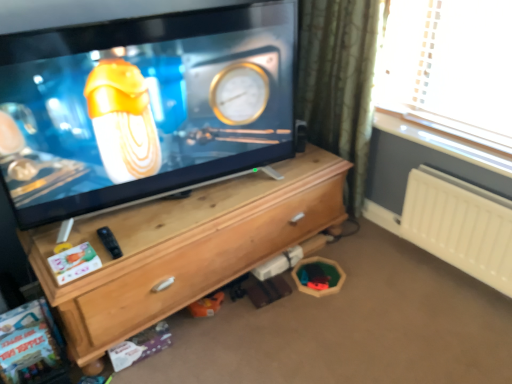
Image resolution: width=512 pixels, height=384 pixels. I want to click on vacant area on top of wooden chest of drawers at center (from a real-world perspective), so pyautogui.click(x=198, y=206).